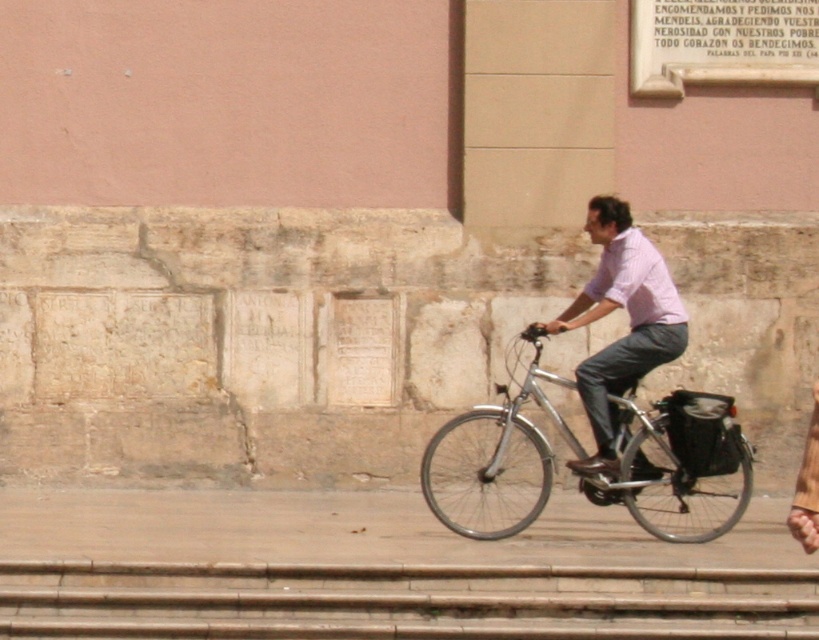
You are a delivery person who needs to carry a large package. You have a silver metallic bicycle at center with a basket and a bag. The pink cotton shirt at center belongs to the rider. Considering the space available, can the package fit on the bicycle without removing the shirt?

The silver metallic bicycle at center has a width larger than the pink cotton shirt at center, so the package can fit on the bicycle without removing the shirt.

You are a pedestrian standing on the sidewalk and see the silver metallic bicycle at center and the pink cotton shirt at center. Which object is closer to the ground?

The silver metallic bicycle at center is closer to the ground because it is located below the pink cotton shirt at center.

You are a pedestrian standing on the sidewalk next to the wall. You see the silver metallic bicycle at center and the pink cotton shirt at center. Which object takes up more space in the scene?

The silver metallic bicycle at center is larger in size than the pink cotton shirt at center, so it takes up more space in the scene.